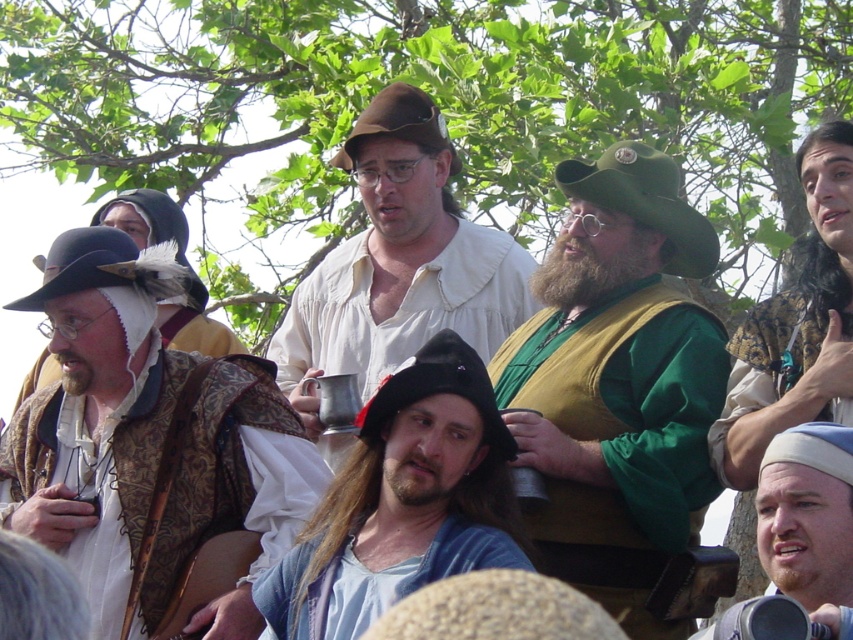
Between point (492, 550) and point (119, 208), which one is positioned in front?

Point (492, 550)

From the picture: Which is below, light blue fabric at center or matte brown vest at left?

light blue fabric at center

Where is `light blue fabric at center`? The width and height of the screenshot is (853, 640). light blue fabric at center is located at coordinates 372,579.

This screenshot has width=853, height=640. I want to click on light blue fabric at center, so click(372, 579).

Does white cotton shirt at center lie in front of camouflage fabric vest at right?

No, it is not.

Where is `white cotton shirt at center`? Image resolution: width=853 pixels, height=640 pixels. white cotton shirt at center is located at coordinates (397, 266).

The width and height of the screenshot is (853, 640). I want to click on white cotton shirt at center, so click(x=397, y=266).

Consider the image. Does gold brocade vest at left appear on the right side of beige fabric headband at lower right?

In fact, gold brocade vest at left is to the left of beige fabric headband at lower right.

Where is `gold brocade vest at left`? This screenshot has width=853, height=640. gold brocade vest at left is located at coordinates (149, 449).